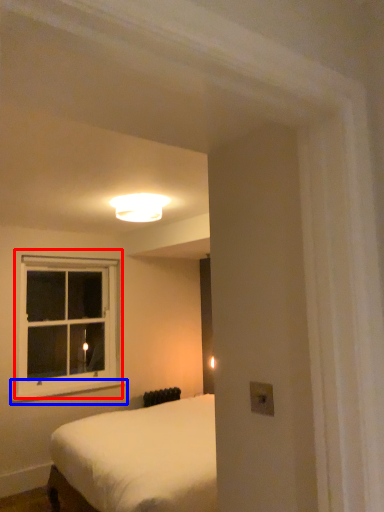
Question: Among these objects, which one is nearest to the camera, window (highlighted by a red box) or window sill (highlighted by a blue box)?

Choices:
 (A) window
 (B) window sill

Answer: (B)